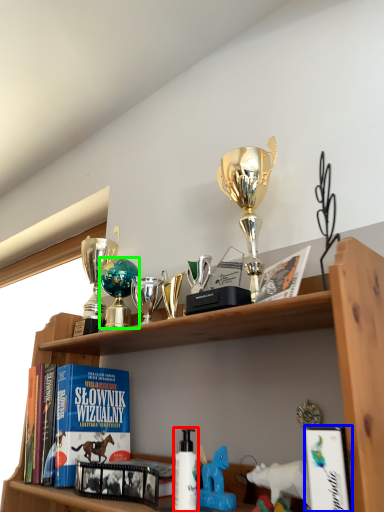
Question: Estimate the real-world distances between objects in this image. Which object is closer to bottle (highlighted by a red box), book (highlighted by a blue box) or toy (highlighted by a green box)?

Choices:
 (A) book
 (B) toy

Answer: (A)